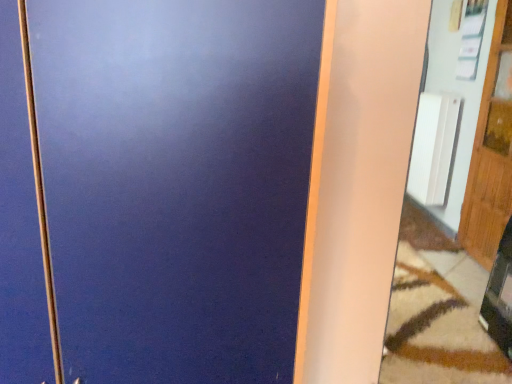
Question: From the image's perspective, is wooden door at right located beneath matte white mirror at right?

Choices:
 (A) yes
 (B) no

Answer: (B)

Question: Is matte white mirror at right inside wooden door at right?

Choices:
 (A) yes
 (B) no

Answer: (B)

Question: Can you confirm if wooden door at right is smaller than matte white mirror at right?

Choices:
 (A) no
 (B) yes

Answer: (B)

Question: Does wooden door at right have a lesser height compared to matte white mirror at right?

Choices:
 (A) no
 (B) yes

Answer: (A)

Question: Does wooden door at right turn towards matte white mirror at right?

Choices:
 (A) no
 (B) yes

Answer: (A)

Question: In terms of height, does white ribbed radiator at right look taller or shorter compared to wooden door at right?

Choices:
 (A) tall
 (B) short

Answer: (B)

Question: In terms of size, does white ribbed radiator at right appear bigger or smaller than wooden door at right?

Choices:
 (A) small
 (B) big

Answer: (A)

Question: From the image's perspective, relative to wooden door at right, is white ribbed radiator at right above or below?

Choices:
 (A) above
 (B) below

Answer: (A)

Question: Is white ribbed radiator at right inside or outside of wooden door at right?

Choices:
 (A) outside
 (B) inside

Answer: (A)

Question: In the image, is wooden door at right on the left side or the right side of matte white mirror at right?

Choices:
 (A) left
 (B) right

Answer: (B)

Question: From their relative heights in the image, would you say wooden door at right is taller or shorter than matte white mirror at right?

Choices:
 (A) short
 (B) tall

Answer: (B)

Question: Would you say wooden door at right is inside or outside matte white mirror at right?

Choices:
 (A) inside
 (B) outside

Answer: (B)

Question: Is wooden door at right in front of or behind matte white mirror at right in the image?

Choices:
 (A) behind
 (B) front

Answer: (A)

Question: Looking at their shapes, would you say white ribbed radiator at right is wider or thinner than matte white mirror at right?

Choices:
 (A) wide
 (B) thin

Answer: (B)

Question: In terms of size, does white ribbed radiator at right appear bigger or smaller than matte white mirror at right?

Choices:
 (A) big
 (B) small

Answer: (B)